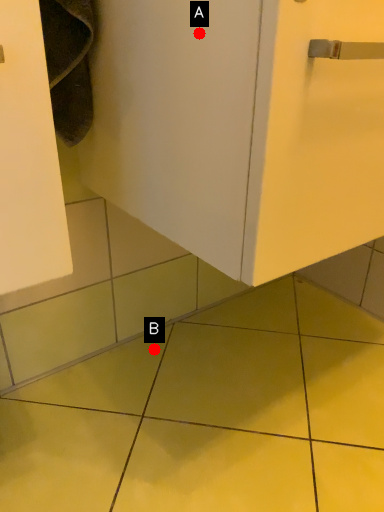
Question: Two points are circled on the image, labeled by A and B beside each circle. Which point appears farthest from the camera in this image?

Choices:
 (A) A is further
 (B) B is further

Answer: (B)